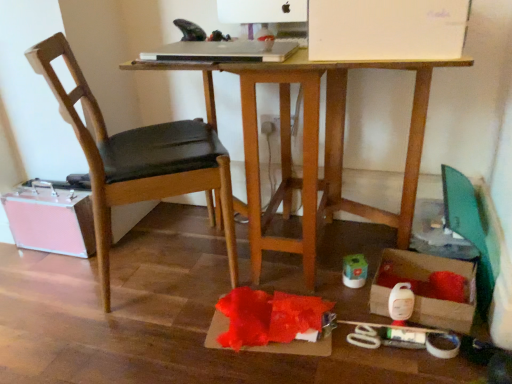
I want to click on vacant position to the left of cardboard box at lower right, positioned as the 1th storage box in right-to-left order, so click(342, 312).